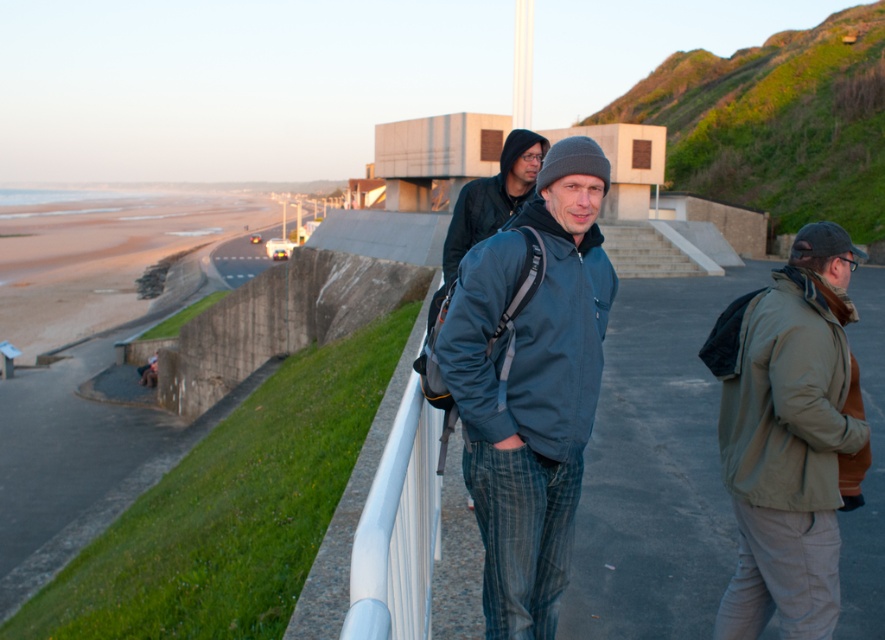
Question: Estimate the real-world distances between objects in this image. Which object is closer to the dark blue jacket at center?

Choices:
 (A) khaki fabric jacket at right
 (B) matte blue jacket at center

Answer: (B)

Question: Is khaki fabric jacket at right positioned behind dark blue jacket at center?

Choices:
 (A) yes
 (B) no

Answer: (B)

Question: Which is farther from the matte blue jacket at center?

Choices:
 (A) khaki fabric jacket at right
 (B) dark blue jacket at center

Answer: (B)

Question: Which of the following is the farthest from the observer?

Choices:
 (A) khaki fabric jacket at right
 (B) dark blue jacket at center
 (C) matte blue jacket at center

Answer: (B)

Question: In this image, where is matte blue jacket at center located relative to khaki fabric jacket at right?

Choices:
 (A) right
 (B) left

Answer: (B)

Question: Where is matte blue jacket at center located in relation to khaki fabric jacket at right in the image?

Choices:
 (A) above
 (B) below

Answer: (A)